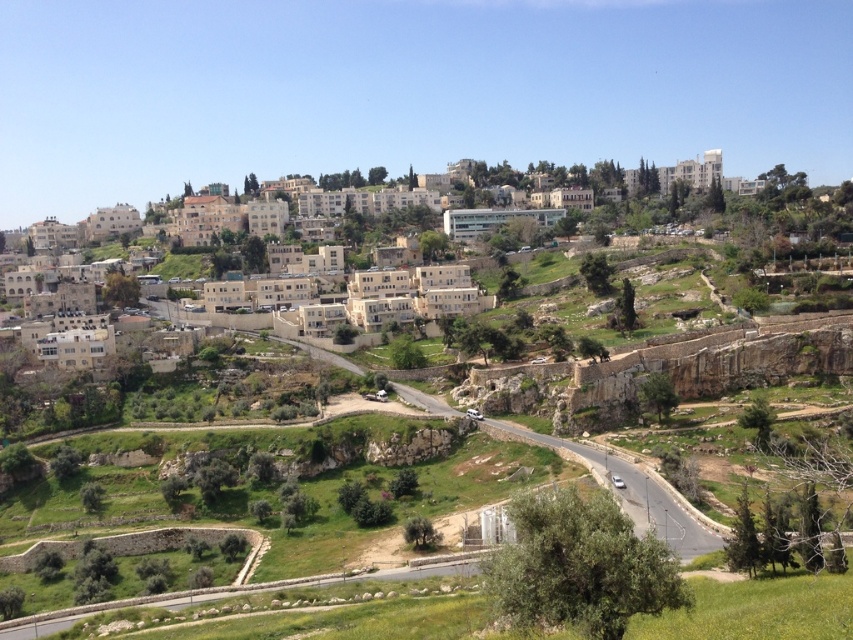
Can you confirm if beige stone buildings at upper center is smaller than green grassy mountain path at center?

No, beige stone buildings at upper center is not smaller than green grassy mountain path at center.

Is point (251, 224) in front of point (654, 483)?

No, (251, 224) is further to viewer.

Where is `beige stone buildings at upper center`? The width and height of the screenshot is (853, 640). beige stone buildings at upper center is located at coordinates (234, 212).